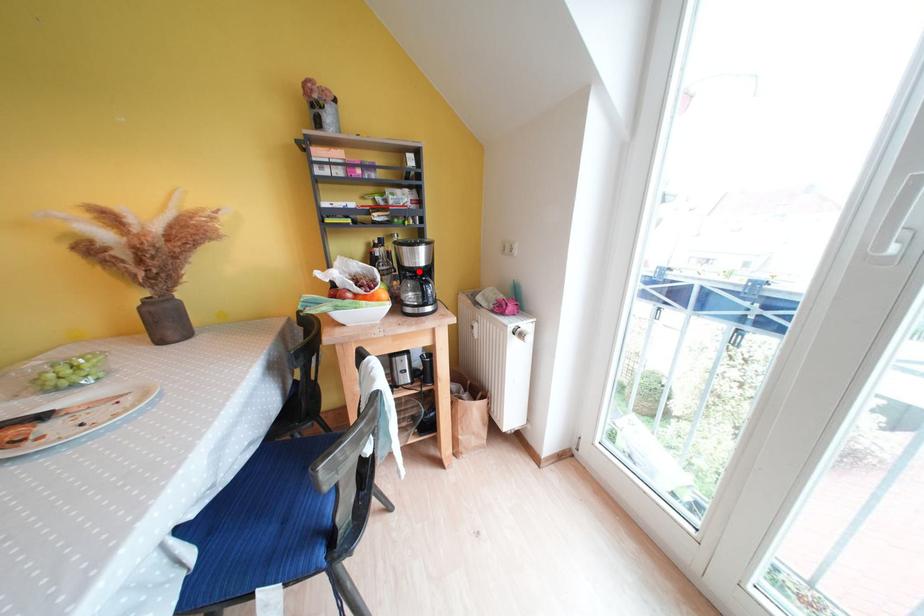
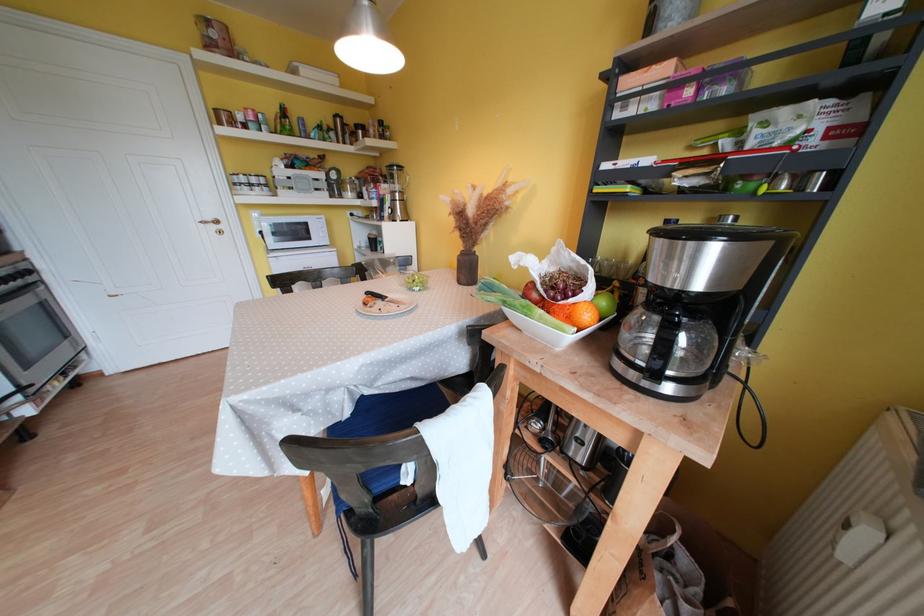
The point at the highlighted location is marked in the first image. Where is the corresponding point in the second image?

(669, 292)